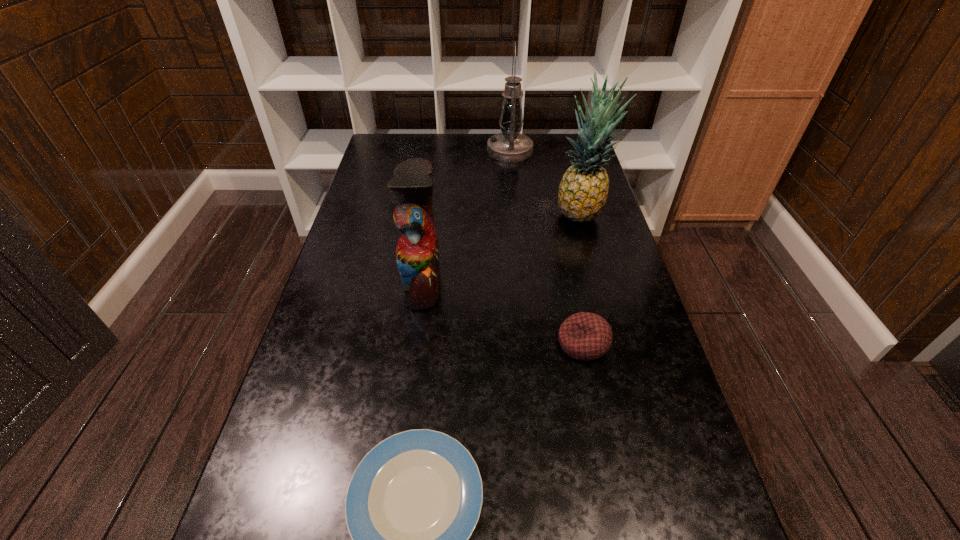
Identify the location of the second farthest object. Image resolution: width=960 pixels, height=540 pixels. (583, 190).

Where is `oil lamp`? The image size is (960, 540). oil lamp is located at coordinates (509, 146).

The width and height of the screenshot is (960, 540). Find the location of `the third tallest object`. the third tallest object is located at coordinates (417, 253).

Identify the location of parrot. Image resolution: width=960 pixels, height=540 pixels. coord(417,253).

Locate an element on the screen. This screenshot has height=540, width=960. the fourth tallest object is located at coordinates (585, 336).

The image size is (960, 540). What are the coordinates of `the fourth farthest object` in the screenshot? It's located at (585, 336).

Where is `blank space located 0.290m on the left of the fourth nearest object`? This screenshot has height=540, width=960. blank space located 0.290m on the left of the fourth nearest object is located at coordinates (460, 214).

Identify the location of blank space located 0.360m on the left of the farthest object. The image size is (960, 540). (391, 151).

At what (x,y) coordinates should I click in order to perform the action: click on vacant point located 0.360m at the face of the third farthest object. Please return your answer as a coordinate pair (x, y). The height and width of the screenshot is (540, 960). Looking at the image, I should click on (581, 281).

This screenshot has width=960, height=540. I want to click on vacant position located 0.220m on the front of the fourth tallest object, so click(x=609, y=467).